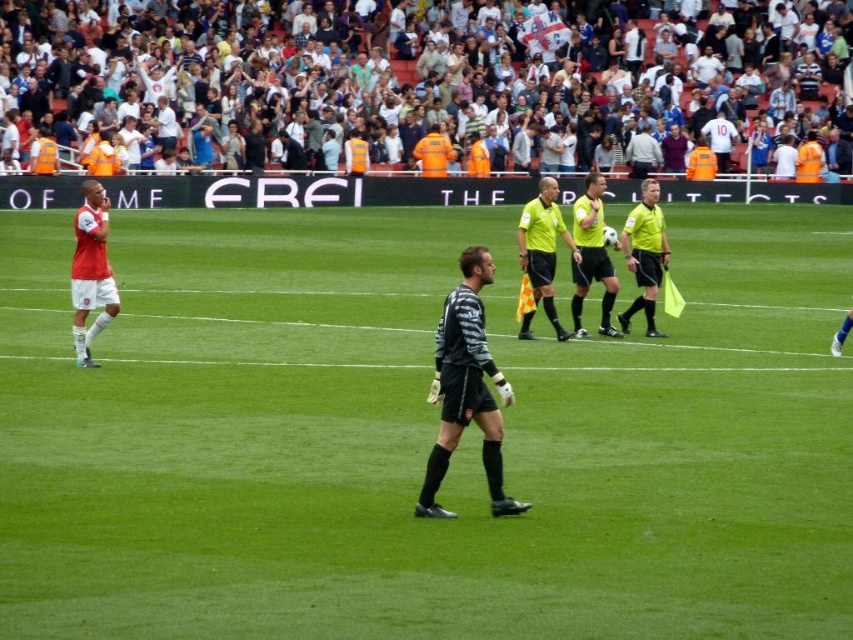
Question: Which point is farther to the camera?

Choices:
 (A) [735, 106]
 (B) [605, 257]
 (C) [105, 234]

Answer: (A)

Question: Is the position of black matte referee at center more distant than that of black matte uniform at center?

Choices:
 (A) yes
 (B) no

Answer: (B)

Question: Does black matte referee at center appear on the left side of black matte uniform at center?

Choices:
 (A) no
 (B) yes

Answer: (A)

Question: From the image, what is the correct spatial relationship of black matte uniform at center in relation to yellow fluorescent uniform at center?

Choices:
 (A) below
 (B) above

Answer: (A)

Question: Among these objects, which one is nearest to the camera?

Choices:
 (A) yellow/green/yellow uniform at center
 (B) orange safety vests at upper center
 (C) yellow fluorescent uniform at center
 (D) matte red jersey at left

Answer: (D)

Question: Which point is farther to the camera?

Choices:
 (A) black matte referee at center
 (B) yellow fluorescent uniform at center
 (C) orange safety vests at upper center

Answer: (C)